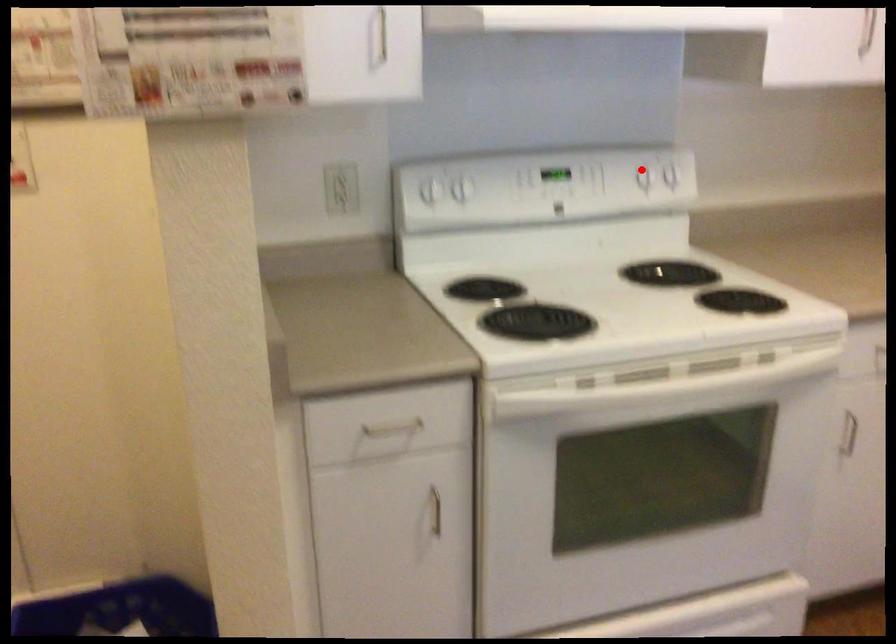
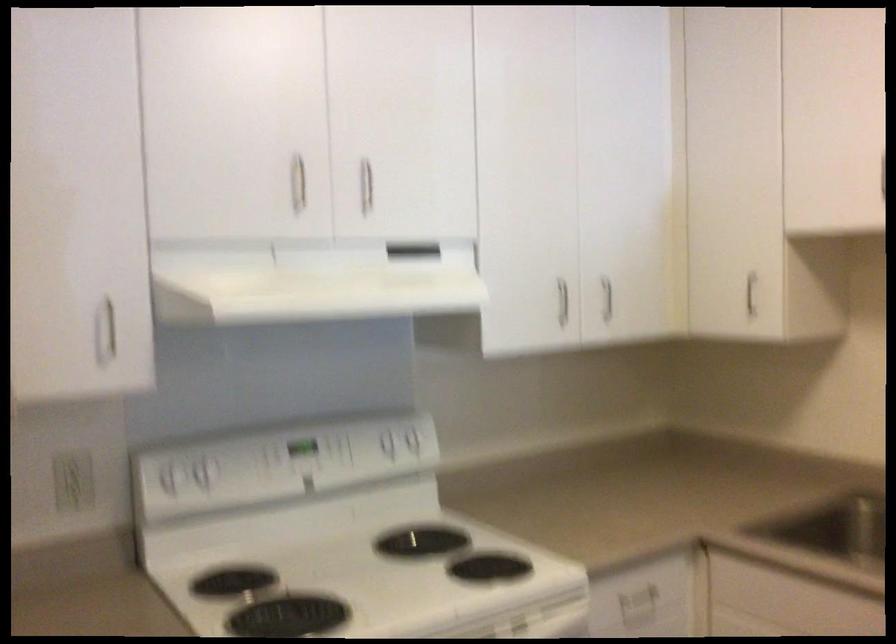
Where in the second image is the point corresponding to the highlighted location from the first image?

(385, 440)